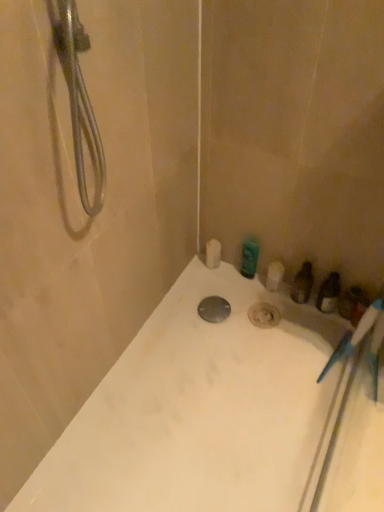
Identify the location of vacant space that's between white matte toilet paper at upper center and metallic silver drain at center. tap(213, 291).